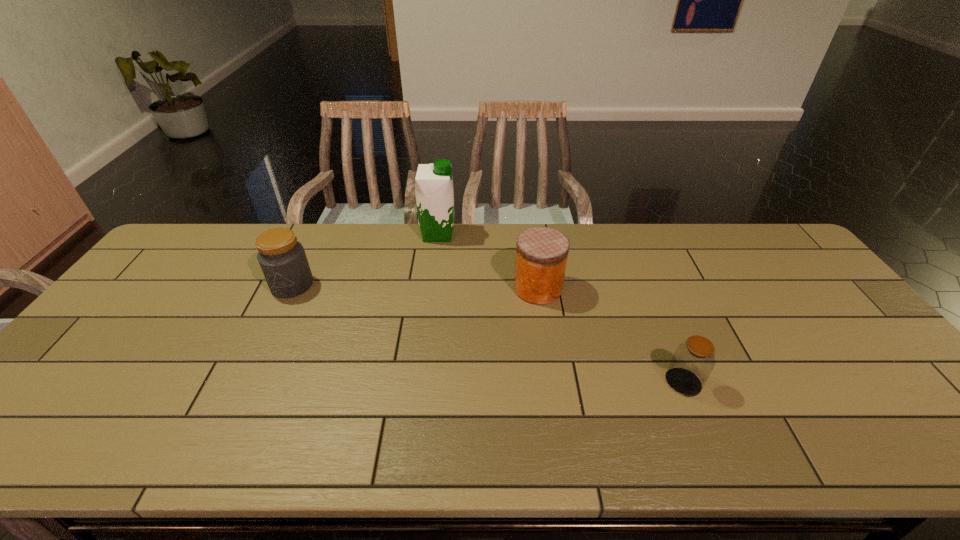
At what (x,y) coordinates should I click in order to perform the action: click on blank space that satisfies the following two spatial constraints: 1. on the front-facing side of the second jar from right to left; 2. on the right side of the farthest object. Please return your answer as a coordinate pair (x, y). Looking at the image, I should click on (431, 288).

In order to click on vacant space that satisfies the following two spatial constraints: 1. on the front side of the second jar from left to right; 2. on the right side of the rightmost object in this screenshot , I will do `click(552, 382)`.

In order to click on vacant space that satisfies the following two spatial constraints: 1. on the front-facing side of the tallest object; 2. on the surface of the leftmost jar near the warning symbol in this screenshot , I will do `click(432, 285)`.

Find the location of a particular element. This screenshot has width=960, height=540. free space that satisfies the following two spatial constraints: 1. on the front-facing side of the farthest object; 2. on the back side of the nearest object is located at coordinates (420, 382).

Find the location of a particular element. Image resolution: width=960 pixels, height=540 pixels. free location that satisfies the following two spatial constraints: 1. on the front-facing side of the farthest object; 2. on the surface of the leftmost jar near the warning symbol is located at coordinates (432, 285).

Where is `vacant space that satisfies the following two spatial constraints: 1. on the front-facing side of the soya milk; 2. on the surface of the leftmost object near the warning symbol`? vacant space that satisfies the following two spatial constraints: 1. on the front-facing side of the soya milk; 2. on the surface of the leftmost object near the warning symbol is located at coordinates (432, 285).

Find the location of a particular element. The image size is (960, 540). vacant region that satisfies the following two spatial constraints: 1. on the front-facing side of the tallest object; 2. on the surface of the leftmost object near the warning symbol is located at coordinates (432, 285).

Locate an element on the screen. This screenshot has height=540, width=960. free spot that satisfies the following two spatial constraints: 1. on the front-facing side of the tallest object; 2. on the right side of the nearest object is located at coordinates (420, 382).